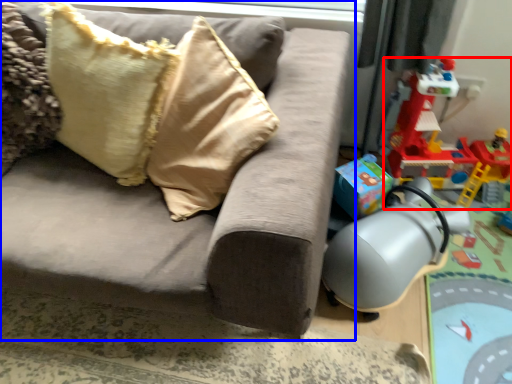
Question: Which object appears closest to the camera in this image, toy (highlighted by a red box) or studio couch (highlighted by a blue box)?

Choices:
 (A) toy
 (B) studio couch

Answer: (B)